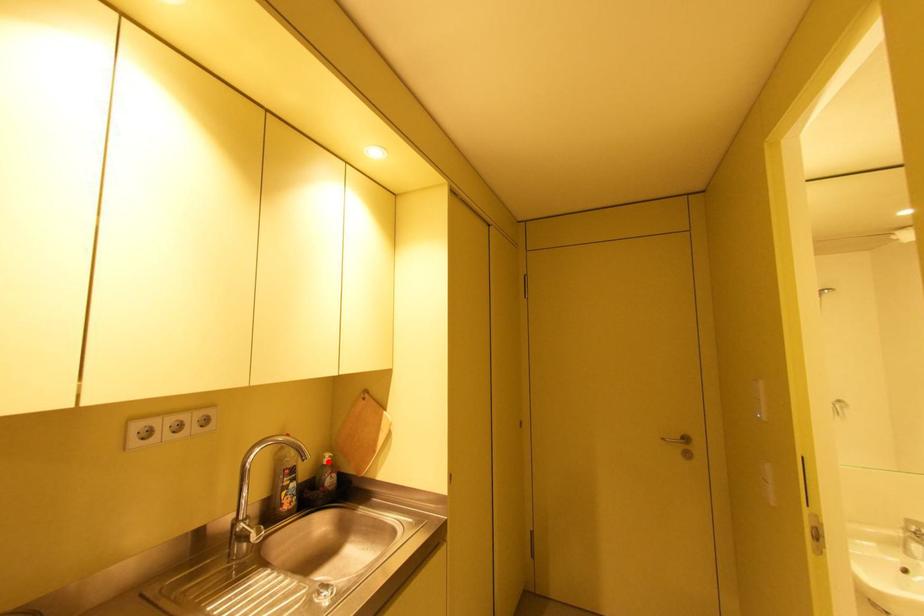
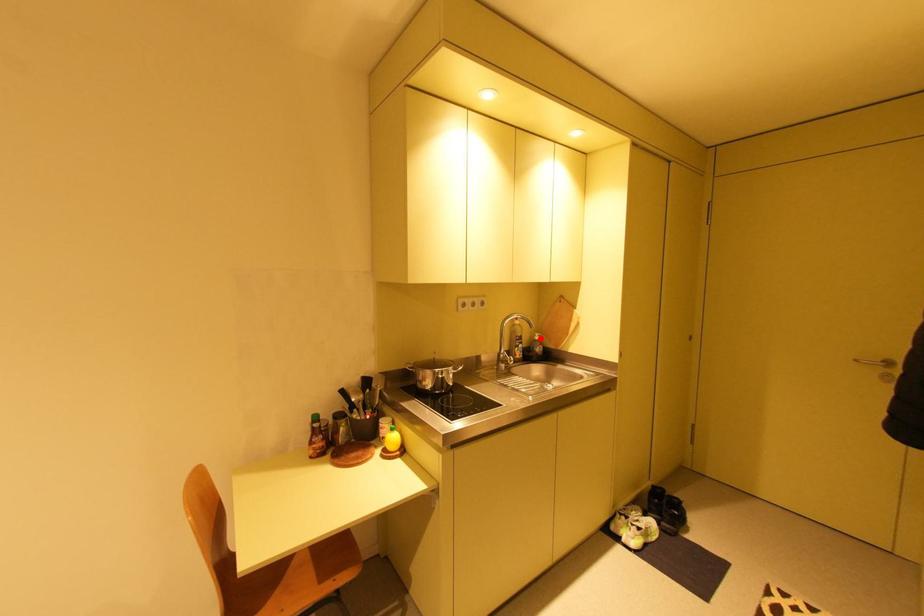
I am providing you with two images of the same scene from different viewpoints. A red point is marked on the first image and another point is marked on the second image. Do the highlighted points in image1 and image2 indicate the same real-world spot?

Yes